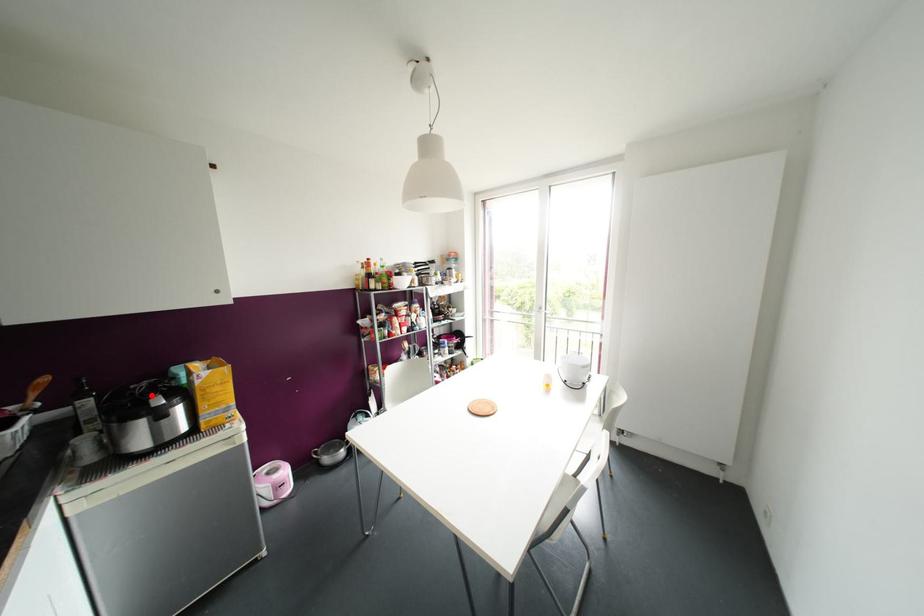
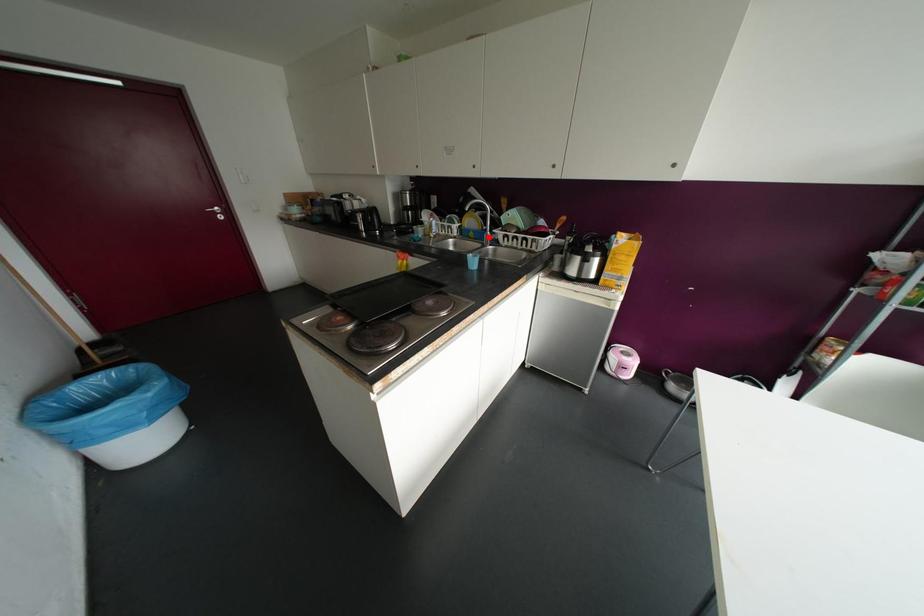
I am providing you with two images of the same scene from different viewpoints. A red point is marked on the first image and another point is marked on the second image. Is the red point in image1 aligned with the point shown in image2?

No